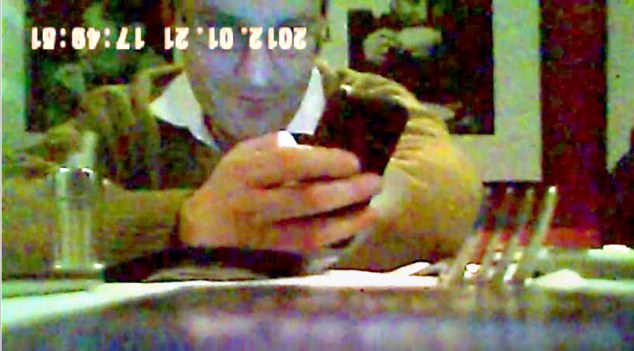
Find the location of `fork`. fork is located at coordinates (515, 233).